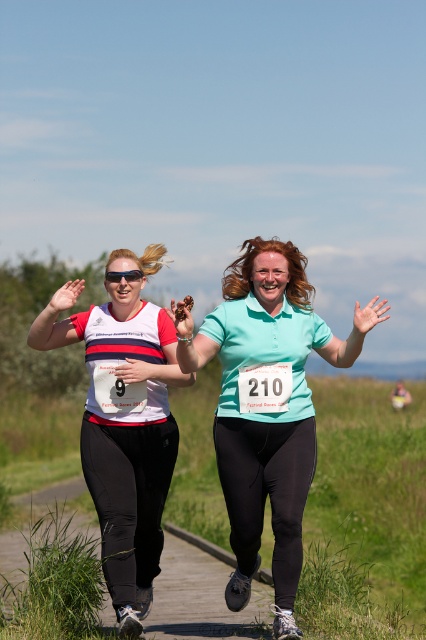
Based on the scene description, where is the teal matte shirt at center located in the image?

The teal matte shirt at center is located at point (x=267, y=410).

You are a photographer positioned at the starting line of the race. You want to capture a photo of both the teal matte shirt at center and the black plastic goggles at center in the same frame. Considering their height difference, which object should you adjust your camera angle to focus on to ensure both are visible?

The teal matte shirt at center is much taller than the black plastic goggles at center. To ensure both are visible in the photo, you should adjust your camera angle to focus on the teal matte shirt at center and lower the angle slightly to include the black plastic goggles at center.

You are a photographer standing at the origin point of the image coordinate system. You need to capture a photo of the white matte shirt at center. What are the coordinates where you should aim your camera?

The coordinates to aim the camera are at point (123,422).